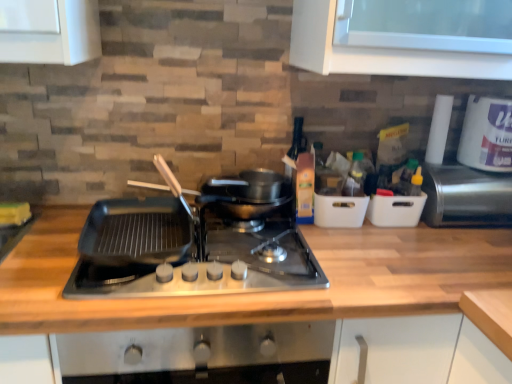
You are a GUI agent. You are given a task and a screenshot of the screen. Output one action in this format:
    pyautogui.click(x=<x>, y=<y>)
    Task: Click on the free point above black matte griddle at center (from a real-world perspective)
    Image resolution: width=512 pixels, height=384 pixels.
    Given the screenshot: What is the action you would take?
    pyautogui.click(x=166, y=221)